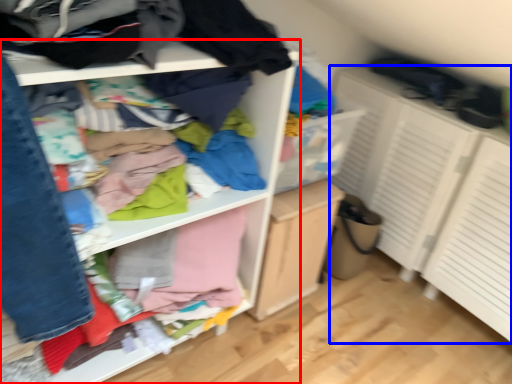
Question: Among these objects, which one is farthest to the camera, shelf (highlighted by a red box) or cabinetry (highlighted by a blue box)?

Choices:
 (A) shelf
 (B) cabinetry

Answer: (B)